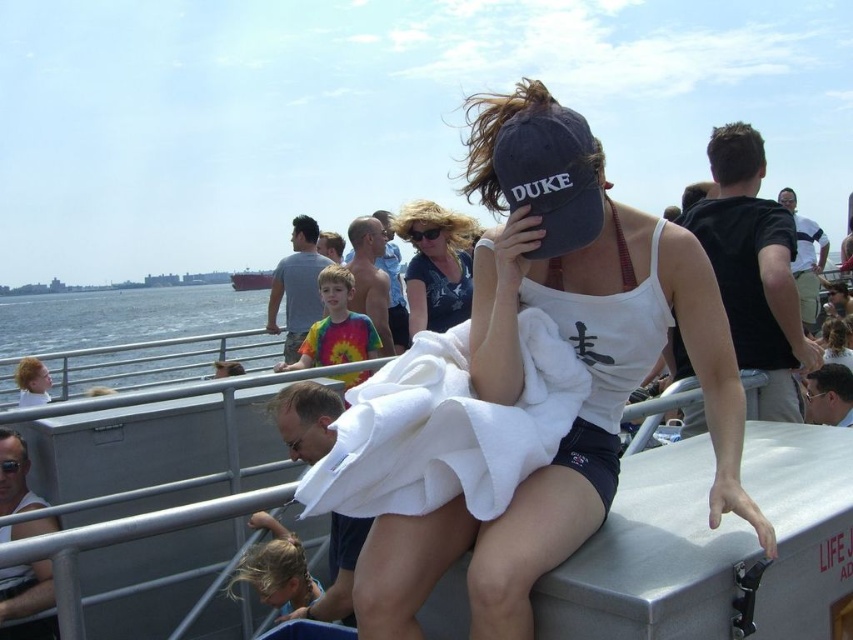
Does matte blue baseball cap at center have a lesser width compared to reddish-brown wooden ship at center?

Yes, matte blue baseball cap at center is thinner than reddish-brown wooden ship at center.

Who is shorter, matte blue baseball cap at center or reddish-brown wooden ship at center?

matte blue baseball cap at center is shorter.

Is point (426, 317) in front of point (235, 276)?

Yes, it is in front of point (235, 276).

Where is `matte blue baseball cap at center`? matte blue baseball cap at center is located at coordinates (436, 264).

Is metallic gray boat at center positioned in front of blue water at lower left?

Yes, it is in front of blue water at lower left.

Does metallic gray boat at center appear on the left side of blue water at lower left?

In fact, metallic gray boat at center is to the right of blue water at lower left.

Where is `metallic gray boat at center`? The image size is (853, 640). metallic gray boat at center is located at coordinates (712, 547).

Can you confirm if blue water at lower left is thinner than matte blue baseball cap at center?

No, blue water at lower left is not thinner than matte blue baseball cap at center.

Does point (173, 353) lie behind point (440, 266)?

Yes.

Where is `blue water at lower left`? This screenshot has height=640, width=853. blue water at lower left is located at coordinates (132, 337).